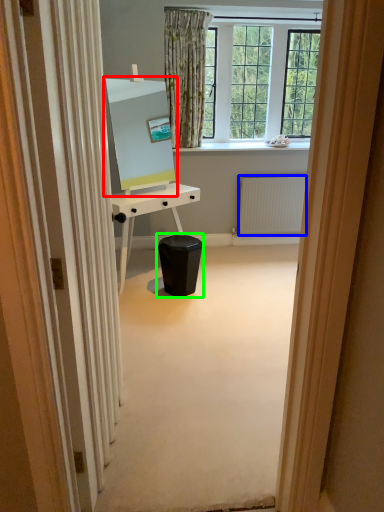
Question: Based on their relative distances, which object is farther from computer monitor (highlighted by a red box)? Choose from radiator (highlighted by a blue box) and music stool (highlighted by a green box).

Choices:
 (A) radiator
 (B) music stool

Answer: (A)